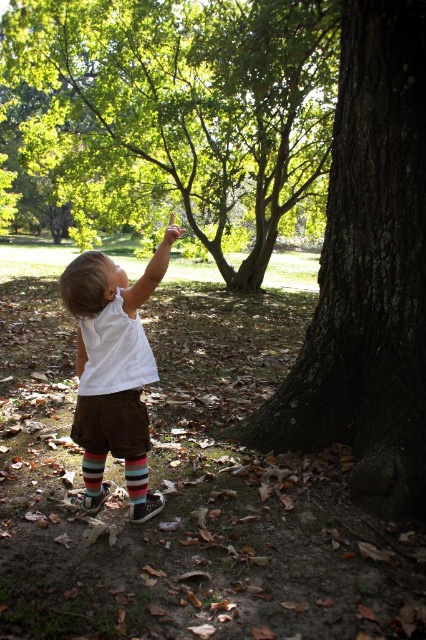
You are a parent trying to take a photo of your child pointing at the green leafy tree at center. The smooth brown hand at upper center is blocking the view. Can you adjust the angle so that the hand is no longer in front of the tree?

The green leafy tree at center is located above the smooth brown hand at upper center. To avoid blocking the view, you can lower your angle so the hand is below the tree in the frame.